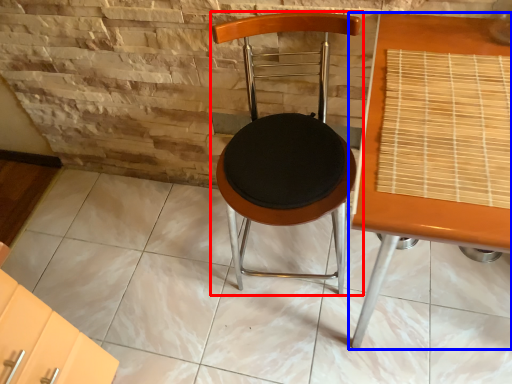
Question: Which object is further to the camera taking this photo, chair (highlighted by a red box) or table (highlighted by a blue box)?

Choices:
 (A) chair
 (B) table

Answer: (A)